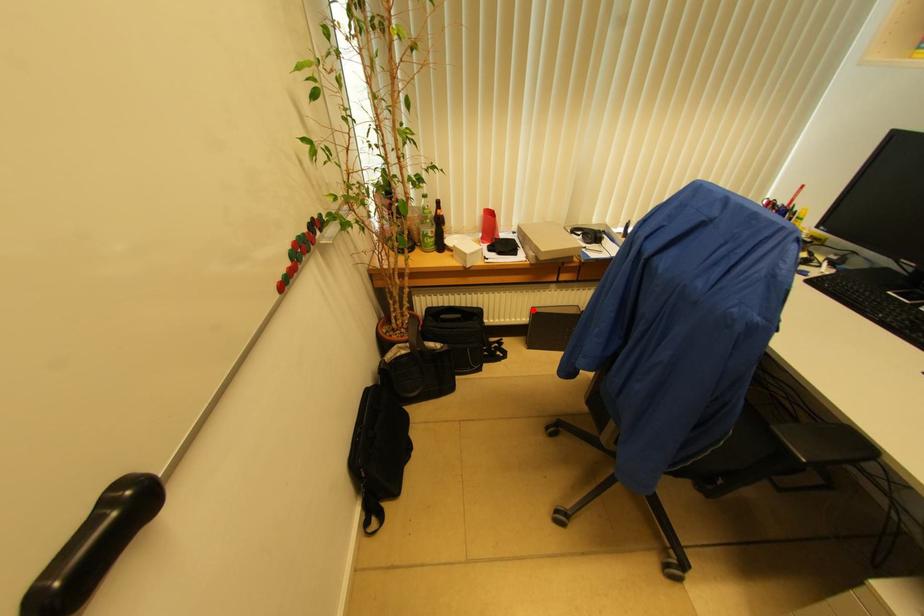
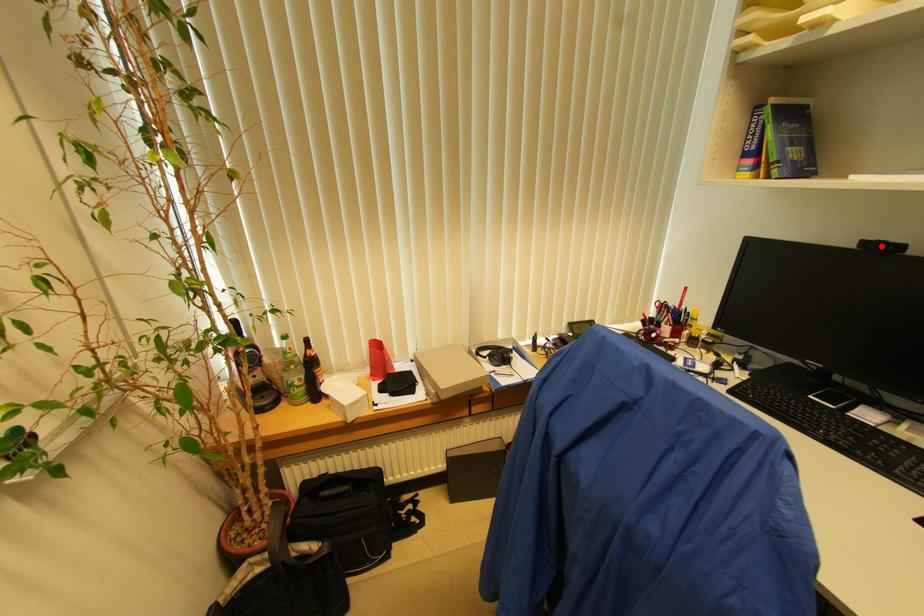
I am providing you with two images of the same scene from different viewpoints. A red point is marked on the first image and another point is marked on the second image. Is the red point in image1 aligned with the point shown in image2?

No